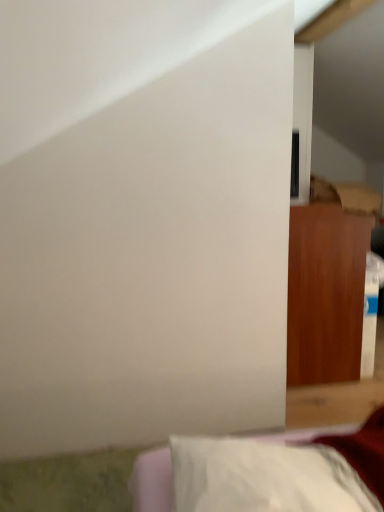
The image size is (384, 512). Find the location of `wooden cabinet at right, placed as the 1th furniture when sorted from top to bottom`. wooden cabinet at right, placed as the 1th furniture when sorted from top to bottom is located at coordinates (325, 293).

What do you see at coordinates (325, 293) in the screenshot? The width and height of the screenshot is (384, 512). I see `wooden cabinet at right, positioned as the second furniture in front-to-back order` at bounding box center [325, 293].

How much space does wooden cabinet at right, placed as the 1th furniture when sorted from top to bottom, occupy horizontally?

38.51 centimeters.

How much space does wooden cabinet at right, which ranks as the second furniture in bottom-to-top order, occupy vertically?

wooden cabinet at right, which ranks as the second furniture in bottom-to-top order, is 30.53 inches in height.

Describe the element at coordinates (364, 451) in the screenshot. I see `white fabric pillow at lower right, the 2th furniture in the back-to-front sequence` at that location.

I want to click on white fabric pillow at lower right, marked as the first furniture in a left-to-right arrangement, so click(364, 451).

Where is `wooden cabinet at right, which ranks as the second furniture in bottom-to-top order`? The image size is (384, 512). wooden cabinet at right, which ranks as the second furniture in bottom-to-top order is located at coordinates (325, 293).

Between wooden cabinet at right, the second furniture positioned from the left, and white fabric pillow at lower right, which appears as the first furniture when viewed from the front, which one appears on the right side from the viewer's perspective?

wooden cabinet at right, the second furniture positioned from the left, is more to the right.

Considering the positions of objects wooden cabinet at right, positioned as the second furniture in front-to-back order, and white fabric pillow at lower right, which is the second furniture in right-to-left order, in the image provided, who is behind, wooden cabinet at right, positioned as the second furniture in front-to-back order, or white fabric pillow at lower right, which is the second furniture in right-to-left order,?

wooden cabinet at right, positioned as the second furniture in front-to-back order, is behind.

Is point (322, 376) less distant than point (382, 426)?

That is False.

From the image's perspective, which one is positioned lower, wooden cabinet at right, placed as the 1th furniture when sorted from top to bottom, or white fabric pillow at lower right, the 2th furniture in the back-to-front sequence?

From the image's view, white fabric pillow at lower right, the 2th furniture in the back-to-front sequence, is below.

Consider the image. From a real-world perspective, relative to white fabric pillow at lower right, which appears as the first furniture when viewed from the front, is wooden cabinet at right, the second furniture positioned from the left, vertically above or below?

In terms of real-world spatial position, wooden cabinet at right, the second furniture positioned from the left, is above white fabric pillow at lower right, which appears as the first furniture when viewed from the front.

Between wooden cabinet at right, the second furniture positioned from the left, and white fabric pillow at lower right, the 2th furniture in the back-to-front sequence, which one has smaller width?

wooden cabinet at right, the second furniture positioned from the left.

Which of these two, wooden cabinet at right, which ranks as the second furniture in bottom-to-top order, or white fabric pillow at lower right, marked as the first furniture in a left-to-right arrangement, stands taller?

wooden cabinet at right, which ranks as the second furniture in bottom-to-top order, is taller.

Does wooden cabinet at right, which ranks as the second furniture in bottom-to-top order, have a smaller size compared to white fabric pillow at lower right, the 2th furniture in the back-to-front sequence?

Incorrect, wooden cabinet at right, which ranks as the second furniture in bottom-to-top order, is not smaller in size than white fabric pillow at lower right, the 2th furniture in the back-to-front sequence.

Is wooden cabinet at right, positioned as the first furniture in right-to-left order, located outside white fabric pillow at lower right, which is the second furniture in right-to-left order?

Yes.

Consider the image. Is wooden cabinet at right, placed as the 1th furniture when sorted from top to bottom, not near white fabric pillow at lower right, which is the second furniture in right-to-left order?

Yes, wooden cabinet at right, placed as the 1th furniture when sorted from top to bottom, and white fabric pillow at lower right, which is the second furniture in right-to-left order, are quite far apart.

Is wooden cabinet at right, positioned as the second furniture in front-to-back order, facing towards white fabric pillow at lower right, marked as the first furniture in a left-to-right arrangement?

No, wooden cabinet at right, positioned as the second furniture in front-to-back order, is not facing towards white fabric pillow at lower right, marked as the first furniture in a left-to-right arrangement.

How far apart are wooden cabinet at right, which ranks as the second furniture in bottom-to-top order, and white fabric pillow at lower right, positioned as the first furniture in bottom-to-top order?

The distance of wooden cabinet at right, which ranks as the second furniture in bottom-to-top order, from white fabric pillow at lower right, positioned as the first furniture in bottom-to-top order, is 1.08 meters.

The width and height of the screenshot is (384, 512). I want to click on furniture that appears behind the white fabric pillow at lower right, which appears as the first furniture when viewed from the front, so click(x=325, y=293).

Which object is positioned more to the left, white fabric pillow at lower right, placed as the 2th furniture when sorted from top to bottom, or wooden cabinet at right, placed as the 1th furniture when sorted from top to bottom?

white fabric pillow at lower right, placed as the 2th furniture when sorted from top to bottom, is more to the left.

Is white fabric pillow at lower right, which is the second furniture in right-to-left order, in front of or behind wooden cabinet at right, placed as the 1th furniture when sorted from top to bottom, in the image?

Clearly, white fabric pillow at lower right, which is the second furniture in right-to-left order, is in front of wooden cabinet at right, placed as the 1th furniture when sorted from top to bottom.

Which point is more distant from viewer, [163,508] or [307,258]?

The point [307,258] is more distant.

From the image's perspective, would you say white fabric pillow at lower right, positioned as the first furniture in bottom-to-top order, is positioned over wooden cabinet at right, positioned as the first furniture in right-to-left order?

No, from the image's perspective, white fabric pillow at lower right, positioned as the first furniture in bottom-to-top order, is not above wooden cabinet at right, positioned as the first furniture in right-to-left order.

From a real-world perspective, is white fabric pillow at lower right, which is the second furniture in right-to-left order, positioned over wooden cabinet at right, which ranks as the second furniture in bottom-to-top order, based on gravity?

No, from a real-world perspective, white fabric pillow at lower right, which is the second furniture in right-to-left order, is not on top of wooden cabinet at right, which ranks as the second furniture in bottom-to-top order.

Considering the relative sizes of white fabric pillow at lower right, positioned as the first furniture in bottom-to-top order, and wooden cabinet at right, positioned as the second furniture in front-to-back order, in the image provided, is white fabric pillow at lower right, positioned as the first furniture in bottom-to-top order, wider than wooden cabinet at right, positioned as the second furniture in front-to-back order,?

Yes, white fabric pillow at lower right, positioned as the first furniture in bottom-to-top order, is wider than wooden cabinet at right, positioned as the second furniture in front-to-back order.

Between white fabric pillow at lower right, the 2th furniture in the back-to-front sequence, and wooden cabinet at right, which ranks as the second furniture in bottom-to-top order, which one has less height?

white fabric pillow at lower right, the 2th furniture in the back-to-front sequence, is shorter.

Does white fabric pillow at lower right, which is the second furniture in right-to-left order, have a smaller size compared to wooden cabinet at right, which ranks as the second furniture in bottom-to-top order?

Yes, white fabric pillow at lower right, which is the second furniture in right-to-left order, is smaller than wooden cabinet at right, which ranks as the second furniture in bottom-to-top order.

Is white fabric pillow at lower right, marked as the first furniture in a left-to-right arrangement, outside of wooden cabinet at right, the first furniture in the back-to-front sequence?

That's correct, white fabric pillow at lower right, marked as the first furniture in a left-to-right arrangement, is outside of wooden cabinet at right, the first furniture in the back-to-front sequence.

Is the surface of white fabric pillow at lower right, which appears as the first furniture when viewed from the front, in direct contact with wooden cabinet at right, positioned as the first furniture in right-to-left order?

There is a gap between white fabric pillow at lower right, which appears as the first furniture when viewed from the front, and wooden cabinet at right, positioned as the first furniture in right-to-left order.

Is white fabric pillow at lower right, placed as the 2th furniture when sorted from top to bottom, facing towards wooden cabinet at right, placed as the 1th furniture when sorted from top to bottom?

No, white fabric pillow at lower right, placed as the 2th furniture when sorted from top to bottom, is not facing towards wooden cabinet at right, placed as the 1th furniture when sorted from top to bottom.

What's the angular difference between white fabric pillow at lower right, which is the second furniture in right-to-left order, and wooden cabinet at right, positioned as the second furniture in front-to-back order,'s facing directions?

The angular difference between white fabric pillow at lower right, which is the second furniture in right-to-left order, and wooden cabinet at right, positioned as the second furniture in front-to-back order, is 171 degrees.

From the picture: Could you measure the distance between white fabric pillow at lower right, the 2th furniture in the back-to-front sequence, and wooden cabinet at right, the second furniture positioned from the left?

The distance of white fabric pillow at lower right, the 2th furniture in the back-to-front sequence, from wooden cabinet at right, the second furniture positioned from the left, is 1.08 meters.

Where is `furniture located on the left of wooden cabinet at right, placed as the 1th furniture when sorted from top to bottom`? The height and width of the screenshot is (512, 384). furniture located on the left of wooden cabinet at right, placed as the 1th furniture when sorted from top to bottom is located at coordinates (364, 451).

Locate an element on the screen. furniture that is above the white fabric pillow at lower right, the 2th furniture in the back-to-front sequence (from a real-world perspective) is located at coordinates (325, 293).

Locate an element on the screen. furniture on the right of white fabric pillow at lower right, placed as the 2th furniture when sorted from top to bottom is located at coordinates (325, 293).